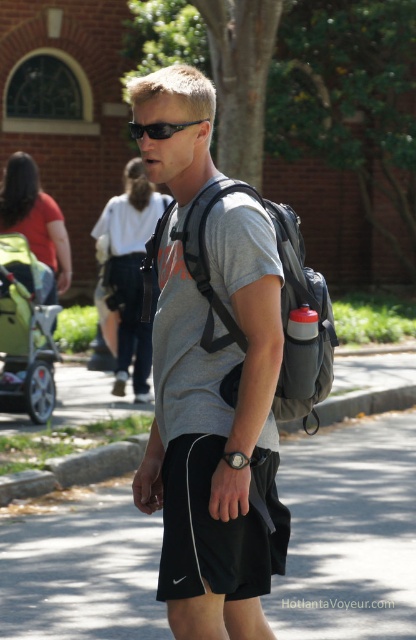
Between black fabric shorts at center and black plastic sunglasses at center, which one appears on the right side from the viewer's perspective?

From the viewer's perspective, black fabric shorts at center appears more on the right side.

Which of these two, black fabric shorts at center or black plastic sunglasses at center, stands shorter?

black plastic sunglasses at center

Is point (165, 554) farther from viewer compared to point (182, 129)?

No.

The width and height of the screenshot is (416, 640). I want to click on black fabric shorts at center, so click(x=217, y=525).

Does point (205, 524) come closer to viewer compared to point (0, 244)?

Yes, it is.

Who is shorter, black fabric shorts at center or green fabric stroller at left?

black fabric shorts at center

Between point (193, 509) and point (25, 342), which one is positioned in front?

Point (193, 509) is in front.

Locate an element on the screen. Image resolution: width=416 pixels, height=640 pixels. black fabric shorts at center is located at coordinates (217, 525).

Between gray matte t-shirt at center and black fabric shorts at center, which one is positioned higher?

gray matte t-shirt at center is above.

Who is positioned more to the left, gray matte t-shirt at center or black fabric shorts at center?

Positioned to the left is gray matte t-shirt at center.

Between point (183, 76) and point (274, 534), which one is positioned in front?

Point (183, 76) is more forward.

Identify the location of gray matte t-shirt at center. (210, 387).